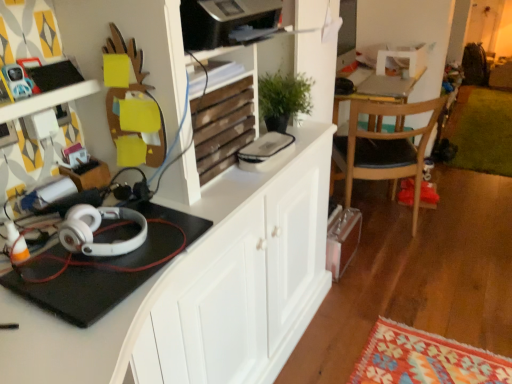
In order to click on free space on the front side of wooden chair with black seat cushion at right in this screenshot , I will do `click(415, 262)`.